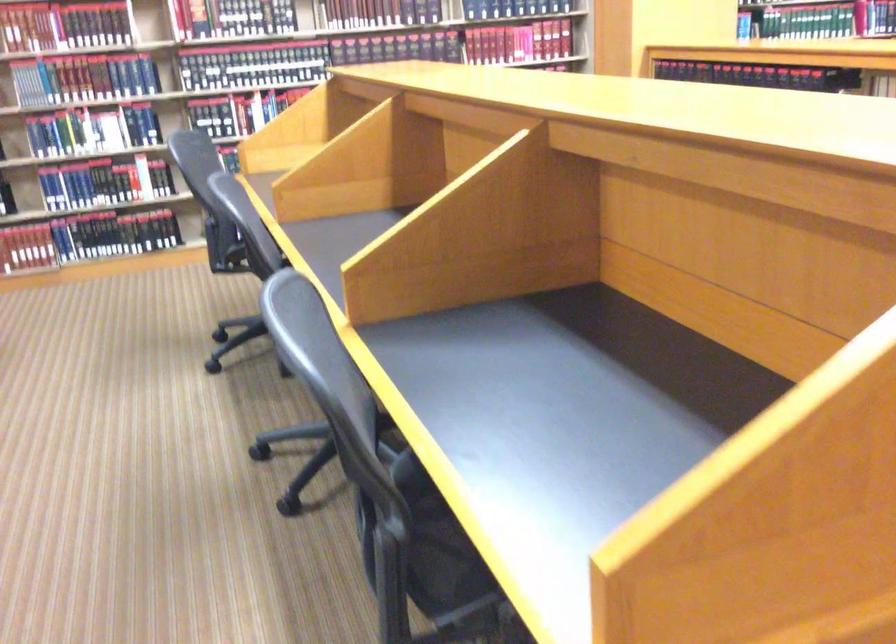
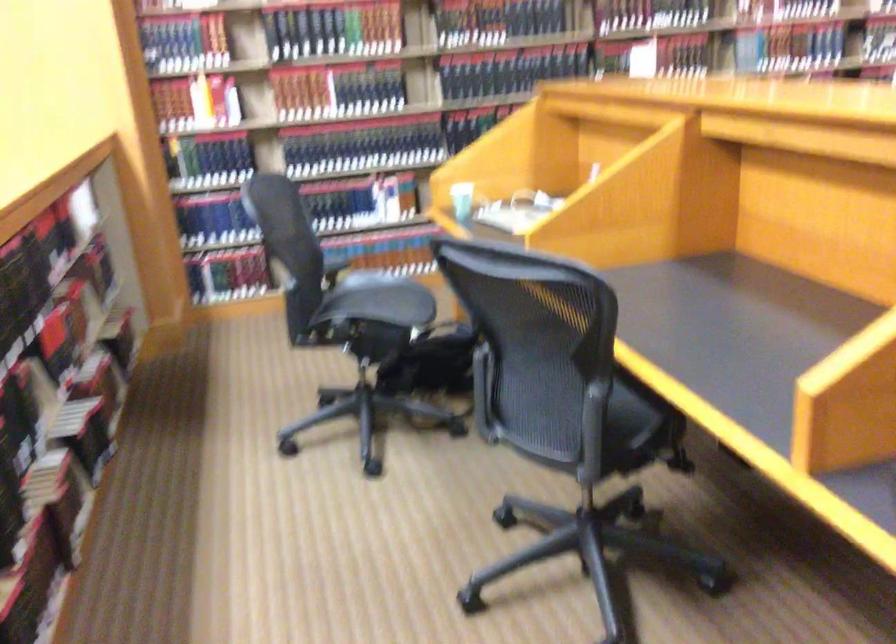
Question: In a continuous first-person perspective shot, in which direction is the camera moving?

Choices:
 (A) Left
 (B) Right
 (C) Forward
 (D) Backward

Answer: (A)